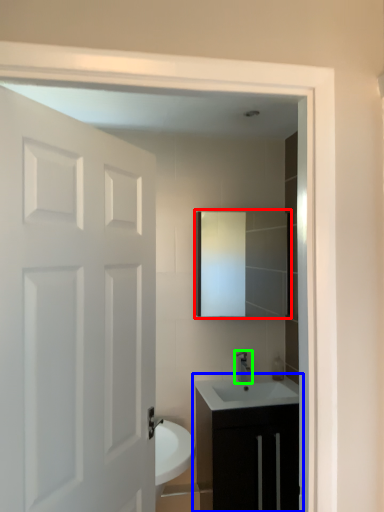
Question: Which object is positioned closest to mirror (highlighted by a red box)? Select from bathroom cabinet (highlighted by a blue box) and tap (highlighted by a green box).

Choices:
 (A) bathroom cabinet
 (B) tap

Answer: (B)